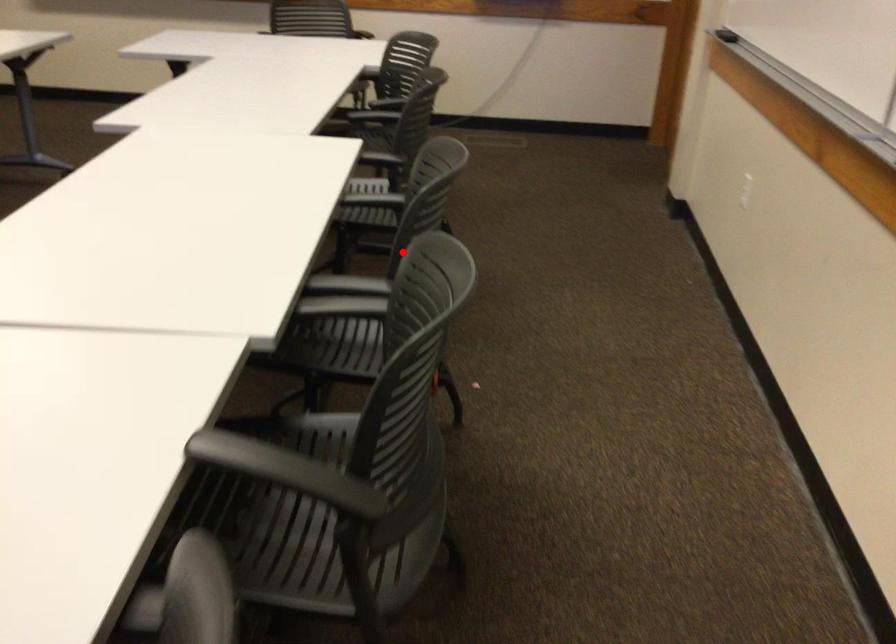
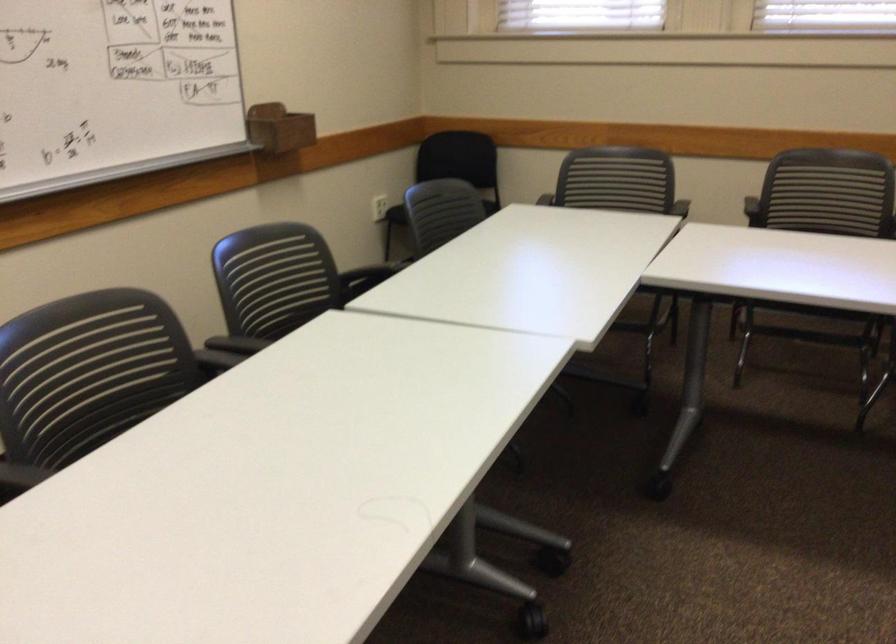
Question: I am providing you with two images of the same scene from different viewpoints. Image1 has a red point marked. In image2, the corresponding 3D location appears at what relative position? Reply with the corresponding letter.

Choices:
 (A) Closer
 (B) Farther

Answer: (B)